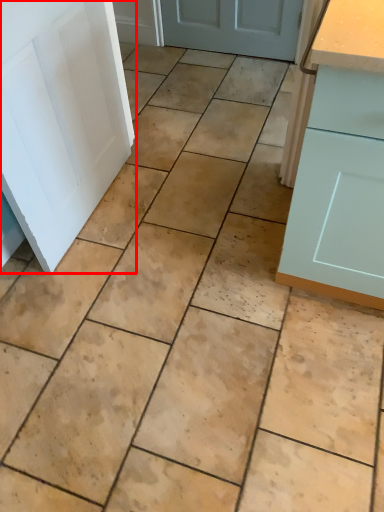
Question: From the image's perspective, where is door (annotated by the red box) located relative to cabinetry?

Choices:
 (A) below
 (B) above

Answer: (B)